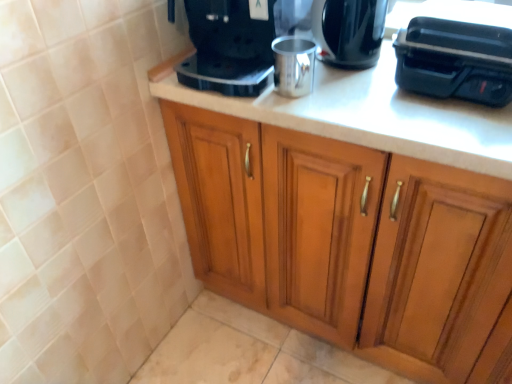
Question: Should I look upward or downward to see wooden cabinet at center?

Choices:
 (A) down
 (B) up

Answer: (A)

Question: From the image's perspective, is shiny black coffee maker at upper center on satin black coffee maker at upper center?

Choices:
 (A) no
 (B) yes

Answer: (A)

Question: Considering the relative sizes of shiny black coffee maker at upper center and satin black coffee maker at upper center in the image provided, is shiny black coffee maker at upper center wider than satin black coffee maker at upper center?

Choices:
 (A) no
 (B) yes

Answer: (A)

Question: Is shiny black coffee maker at upper center outside satin black coffee maker at upper center?

Choices:
 (A) yes
 (B) no

Answer: (A)

Question: Is shiny black coffee maker at upper center oriented away from satin black coffee maker at upper center?

Choices:
 (A) yes
 (B) no

Answer: (B)

Question: Is shiny black coffee maker at upper center closer to camera compared to satin black coffee maker at upper center?

Choices:
 (A) no
 (B) yes

Answer: (A)

Question: From a real-world perspective, is shiny black coffee maker at upper center over satin black coffee maker at upper center?

Choices:
 (A) no
 (B) yes

Answer: (A)

Question: Is silver metallic cup at center, the first appliance from the left, located within shiny black coffee maker at upper center?

Choices:
 (A) no
 (B) yes

Answer: (A)

Question: Is shiny black coffee maker at upper center closer to camera compared to silver metallic cup at center, the first appliance from the left?

Choices:
 (A) yes
 (B) no

Answer: (B)

Question: Considering the relative sizes of shiny black coffee maker at upper center and silver metallic cup at center, positioned as the second appliance in right-to-left order, in the image provided, is shiny black coffee maker at upper center smaller than silver metallic cup at center, positioned as the second appliance in right-to-left order,?

Choices:
 (A) yes
 (B) no

Answer: (B)

Question: From the image's perspective, is shiny black coffee maker at upper center under silver metallic cup at center, the first appliance from the left?

Choices:
 (A) no
 (B) yes

Answer: (A)

Question: Is shiny black coffee maker at upper center oriented towards silver metallic cup at center, positioned as the second appliance in right-to-left order?

Choices:
 (A) no
 (B) yes

Answer: (B)

Question: Does shiny black coffee maker at upper center have a lesser height compared to silver metallic cup at center, the first appliance from the left?

Choices:
 (A) no
 (B) yes

Answer: (A)

Question: Considering the relative sizes of black plastic toaster at upper right, acting as the 1th appliance starting from the right, and satin black coffee maker at upper center in the image provided, is black plastic toaster at upper right, acting as the 1th appliance starting from the right, smaller than satin black coffee maker at upper center?

Choices:
 (A) yes
 (B) no

Answer: (A)